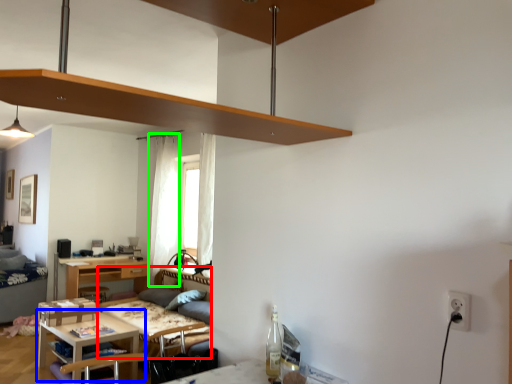
Question: Which object is the closest to the couch (highlighted by a red box)? Choose among these: table (highlighted by a blue box) or curtain (highlighted by a green box).

Choices:
 (A) table
 (B) curtain

Answer: (A)